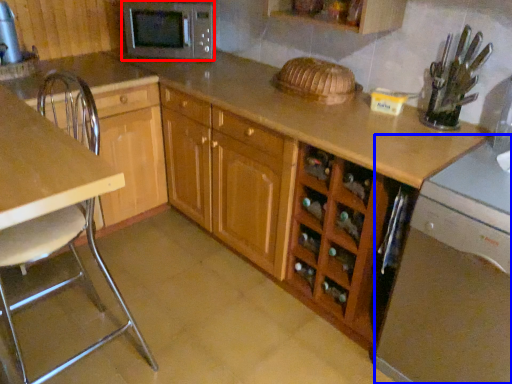
Question: Which of the following is the closest to the observer, microwave oven (highlighted by a red box) or dish washer (highlighted by a blue box)?

Choices:
 (A) microwave oven
 (B) dish washer

Answer: (B)